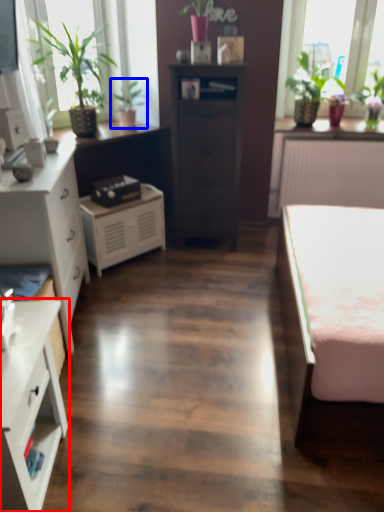
Question: Among these objects, which one is nearest to the camera, chest of drawers (highlighted by a red box) or houseplant (highlighted by a blue box)?

Choices:
 (A) chest of drawers
 (B) houseplant

Answer: (A)